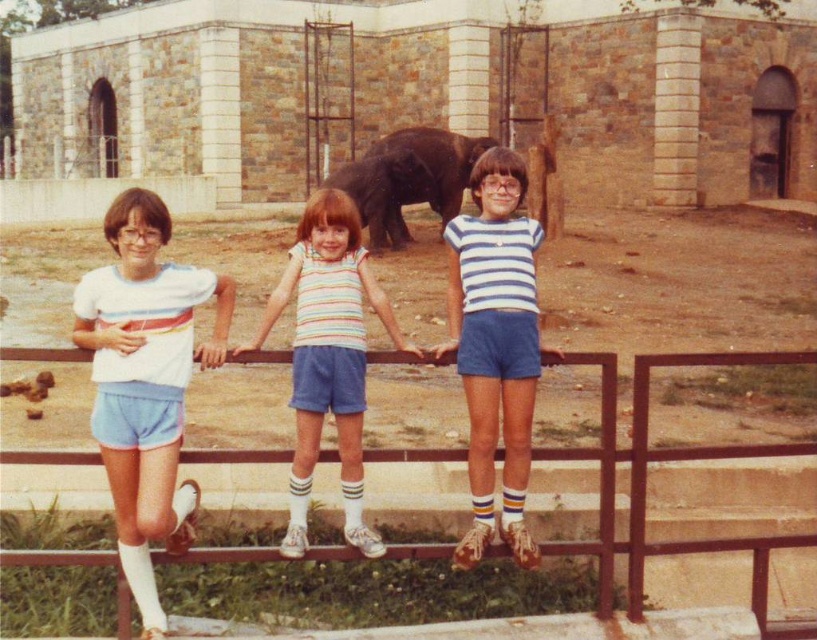
You are a photographer trying to capture a photo of the metallic brown fence at center and the blue striped shirt at center. Based on their sizes in the image, which one should you focus on first if you want to ensure both are in frame without zooming?

The metallic brown fence at center occupies less space than blue striped shirt at center, so you should focus on the blue striped shirt at center first to ensure both fit in the frame without zooming.

You are a photographer trying to capture a photo of the metallic brown fence at center and the blue striped shirt at center. Which object should you focus on first to ensure both are in sharp focus?

You should focus on the metallic brown fence at center first because it is closer to the viewer than the blue striped shirt at center, ensuring both will be in focus when using depth of field appropriately.